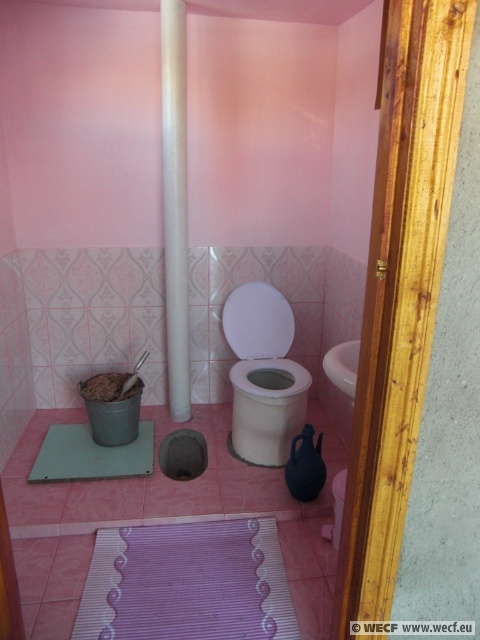
Between white glossy toilet bowl at center and green rubber bath mat at lower center, which one has more height?

Standing taller between the two is white glossy toilet bowl at center.

Can you confirm if white glossy toilet bowl at center is taller than green rubber bath mat at lower center?

Yes.

This screenshot has height=640, width=480. I want to click on white glossy toilet bowl at center, so click(263, 374).

Find the location of a particular element. This screenshot has height=640, width=480. white glossy toilet bowl at center is located at coordinates (263, 374).

Can you confirm if purple striped bath mat at lower center is smaller than green rubber bath mat at lower center?

No.

You are a GUI agent. You are given a task and a screenshot of the screen. Output one action in this format:
    pyautogui.click(x=<x>, y=<y>)
    Task: Click on the purple striped bath mat at lower center
    
    Given the screenshot: What is the action you would take?
    pyautogui.click(x=188, y=582)

Does point (111, 625) come behind point (73, 470)?

No, (111, 625) is closer to viewer.

You are a GUI agent. You are given a task and a screenshot of the screen. Output one action in this format:
    pyautogui.click(x=<x>, y=<y>)
    Task: Click on the purple striped bath mat at lower center
    This screenshot has width=480, height=640.
    Given the screenshot: What is the action you would take?
    pyautogui.click(x=188, y=582)

Is white glossy toilet bowl at center wider than white glossy pipe at center?

Yes.

Based on the photo, between white glossy toilet bowl at center and white glossy pipe at center, which one is positioned lower?

white glossy toilet bowl at center is below.

Which is in front, point (251, 356) or point (165, 179)?

Point (165, 179) is in front.

Locate an element on the screen. This screenshot has height=640, width=480. white glossy toilet bowl at center is located at coordinates (263, 374).